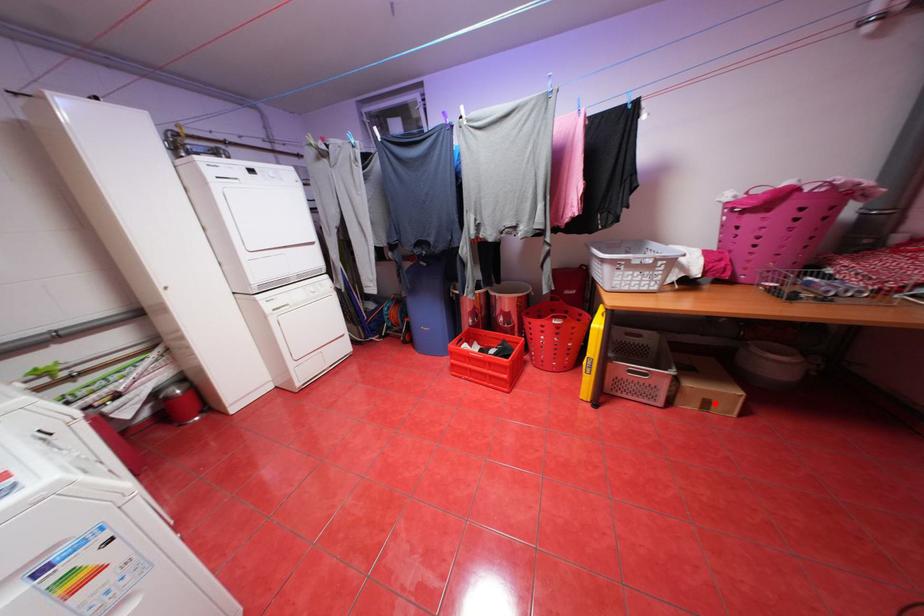
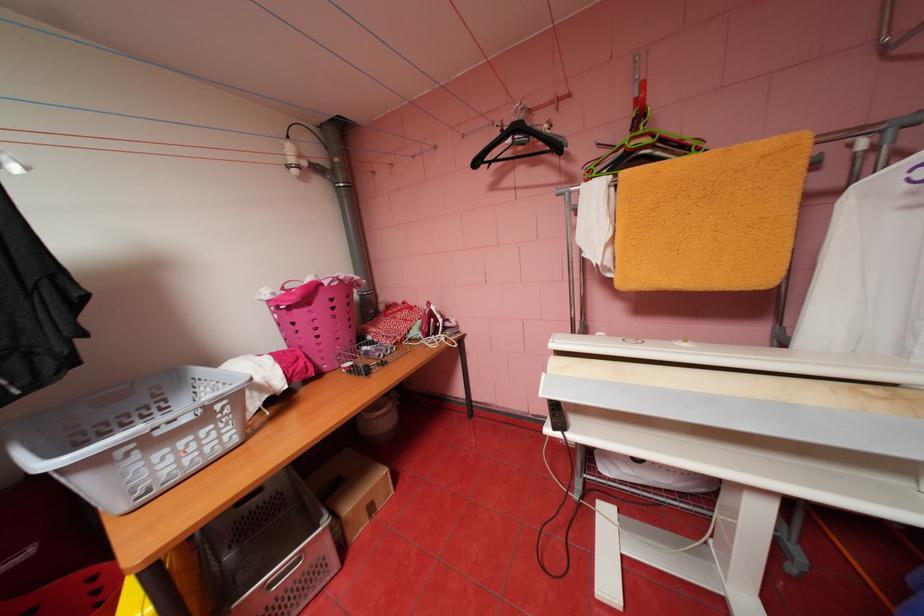
The point at the highlighted location is marked in the first image. Where is the corresponding point in the second image?

(380, 508)